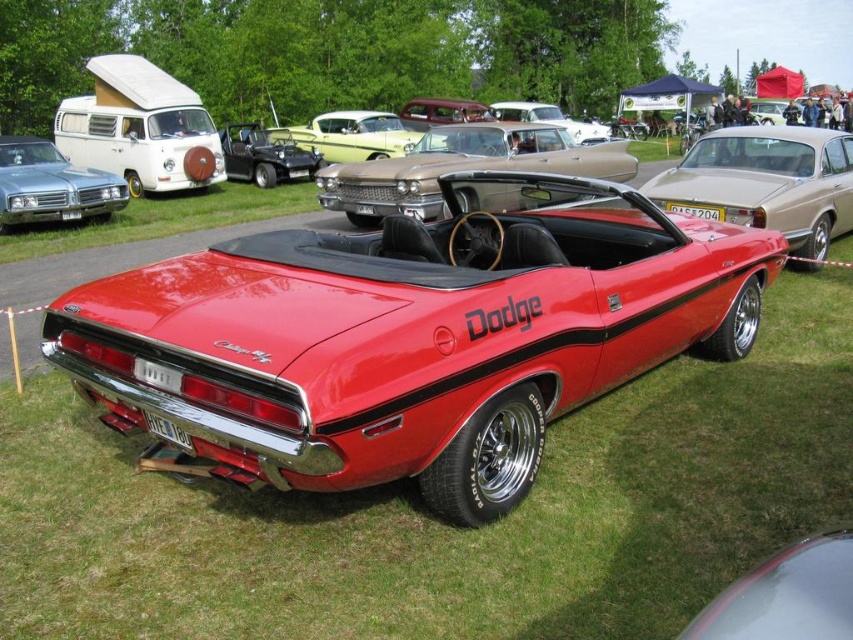
Can you confirm if shiny red dodge convertible at center is shorter than shiny silver sedan at left?

Correct, shiny red dodge convertible at center is not as tall as shiny silver sedan at left.

How much distance is there between shiny red dodge convertible at center and shiny silver sedan at left?

The distance of shiny red dodge convertible at center from shiny silver sedan at left is 11.13 meters.

Is point (711, 188) positioned before point (12, 189)?

Yes, point (711, 188) is closer to viewer.

Where is `shiny red dodge convertible at center`? The height and width of the screenshot is (640, 853). shiny red dodge convertible at center is located at coordinates (766, 182).

Does point (45, 154) lie behind point (390, 152)?

No.

Between point (83, 214) and point (361, 125), which one is positioned in front?

Point (83, 214) is in front.

Where is `shiny silver sedan at left`? shiny silver sedan at left is located at coordinates (51, 186).

Who is positioned more to the left, metallic yellow car at center or metallic black convertible at center?

metallic black convertible at center

This screenshot has width=853, height=640. Describe the element at coordinates (351, 134) in the screenshot. I see `metallic yellow car at center` at that location.

Is point (314, 140) in front of point (254, 124)?

Yes.

The width and height of the screenshot is (853, 640). Identify the location of metallic yellow car at center. (351, 134).